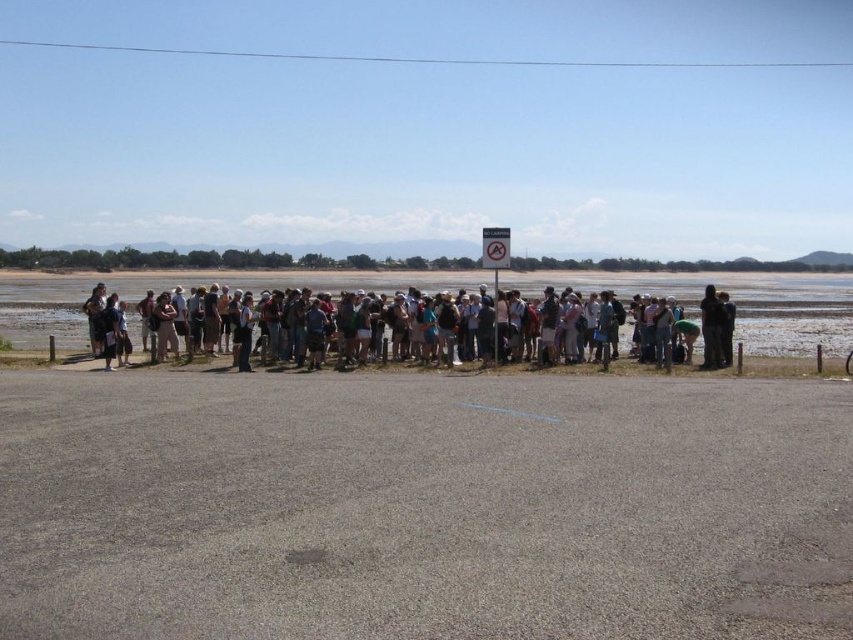
Question: Which of the following is the closest to the observer?

Choices:
 (A) clear blue sky at upper center
 (B) matte black backpack at center

Answer: (B)

Question: Which point is farther to the camera?

Choices:
 (A) (329, 54)
 (B) (149, 305)

Answer: (A)

Question: Is clear blue sky at upper center further to camera compared to matte black backpack at center?

Choices:
 (A) no
 (B) yes

Answer: (B)

Question: Can you confirm if clear blue sky at upper center is thinner than matte black backpack at center?

Choices:
 (A) yes
 (B) no

Answer: (B)

Question: Is clear blue sky at upper center positioned behind matte black backpack at center?

Choices:
 (A) yes
 (B) no

Answer: (A)